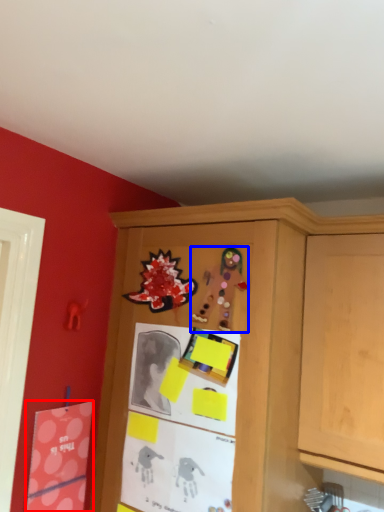
Question: Which object is further to the camera taking this photo, postcard (highlighted by a red box) or art (highlighted by a blue box)?

Choices:
 (A) postcard
 (B) art

Answer: (A)